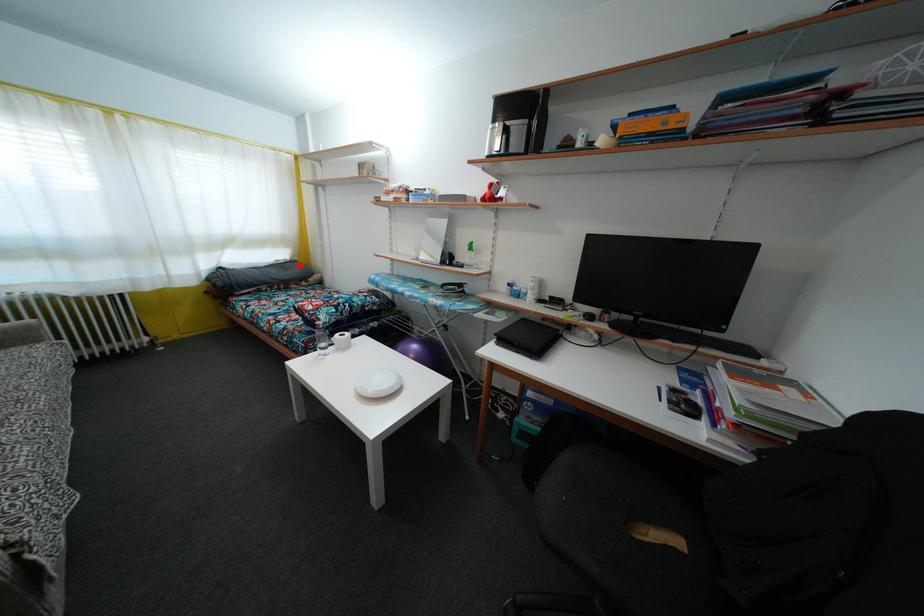
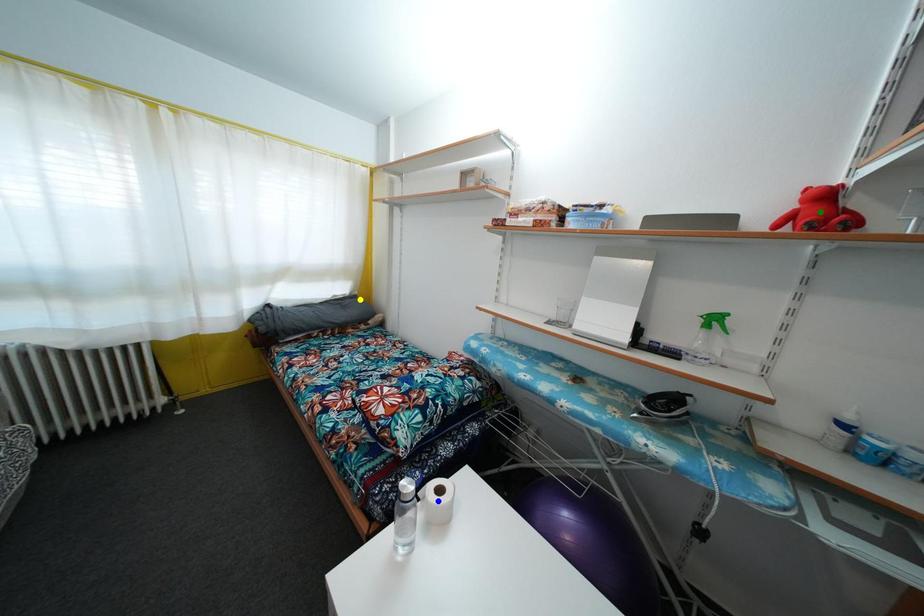
Question: I am providing you with two images of the same scene from different viewpoints. A red point is marked on the first image. You are given multiple points on the second image. Can you choose the point in image 2 that corresponds to the point in image 1?

Choices:
 (A) blue point
 (B) green point
 (C) yellow point

Answer: (C)